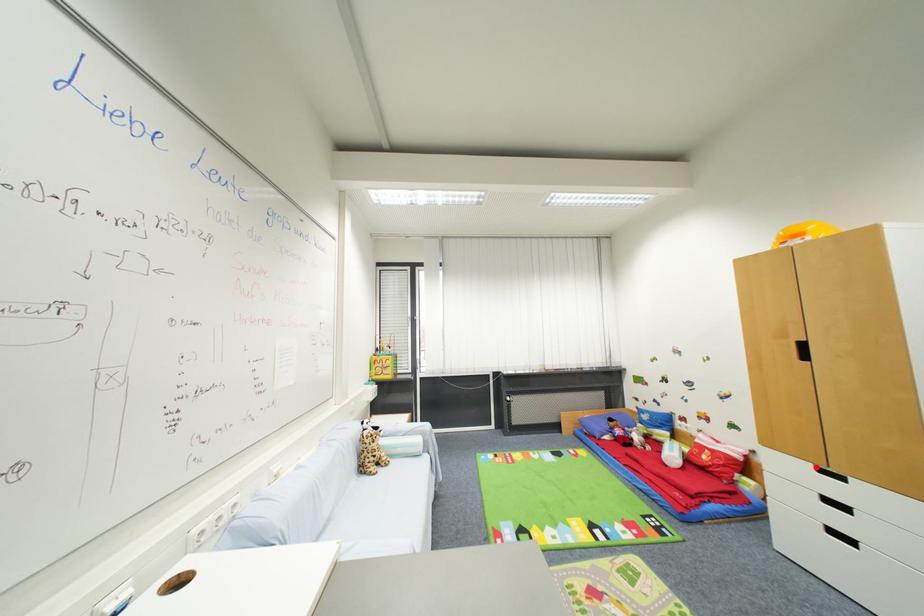
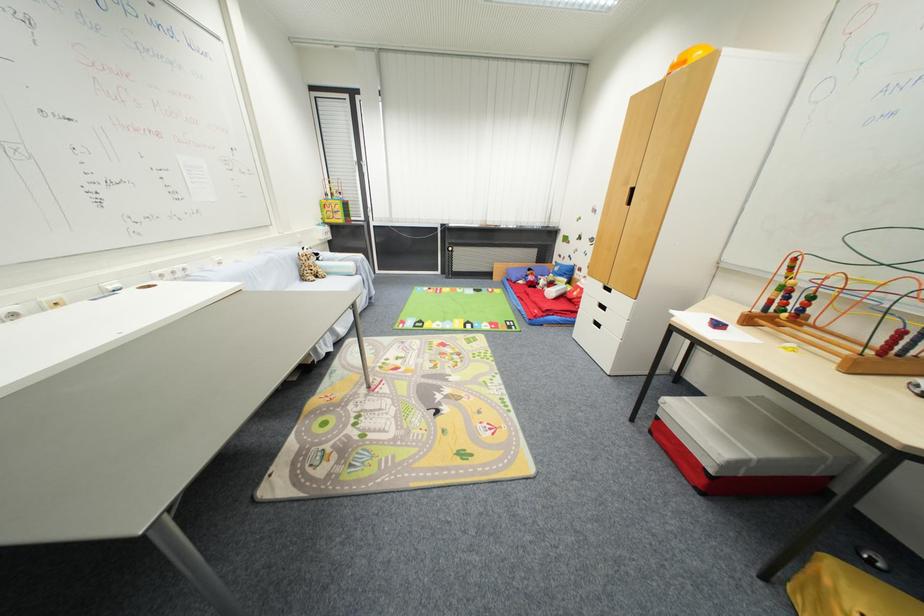
The point at the highlighted location is marked in the first image. Where is the corresponding point in the second image?

(606, 286)